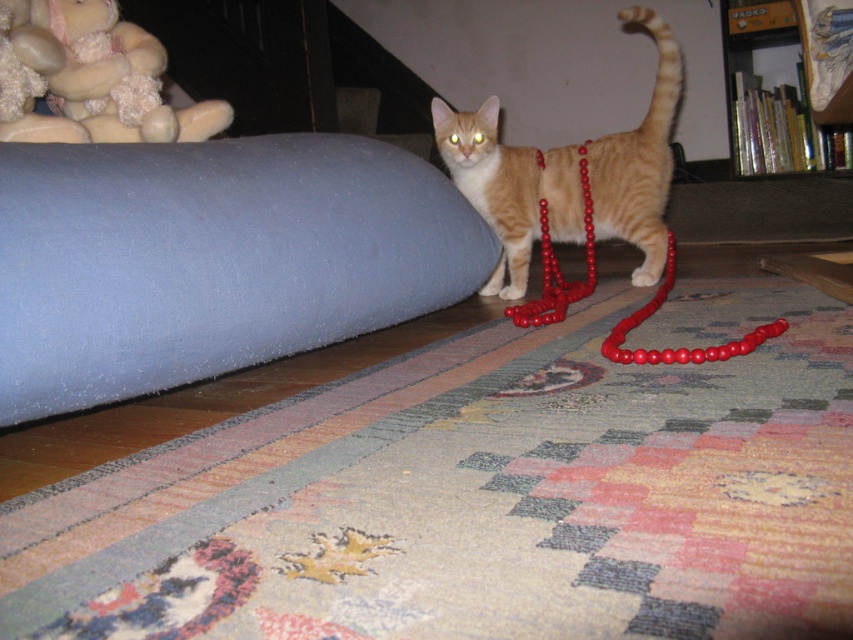
Question: Is carpeted floor at lower center to the right of red beads at center from the viewer's perspective?

Choices:
 (A) no
 (B) yes

Answer: (A)

Question: Can you confirm if orange fur cat at center is positioned below soft beige plush at upper left?

Choices:
 (A) no
 (B) yes

Answer: (B)

Question: Does carpeted floor at lower center have a larger size compared to red beads at center?

Choices:
 (A) no
 (B) yes

Answer: (B)

Question: Among these objects, which one is farthest from the camera?

Choices:
 (A) red beads at center
 (B) soft beige plush at upper left
 (C) carpeted floor at lower center
 (D) red beaded necklace at center

Answer: (D)

Question: Considering the real-world distances, which object is farthest from the carpeted floor at lower center?

Choices:
 (A) orange fur cat at center
 (B) soft beige plush at upper left
 (C) red beads at center

Answer: (B)

Question: Which object appears closest to the camera in this image?

Choices:
 (A) carpeted floor at lower center
 (B) soft beige plush at upper left
 (C) red beads at center
 (D) orange fur cat at center

Answer: (A)